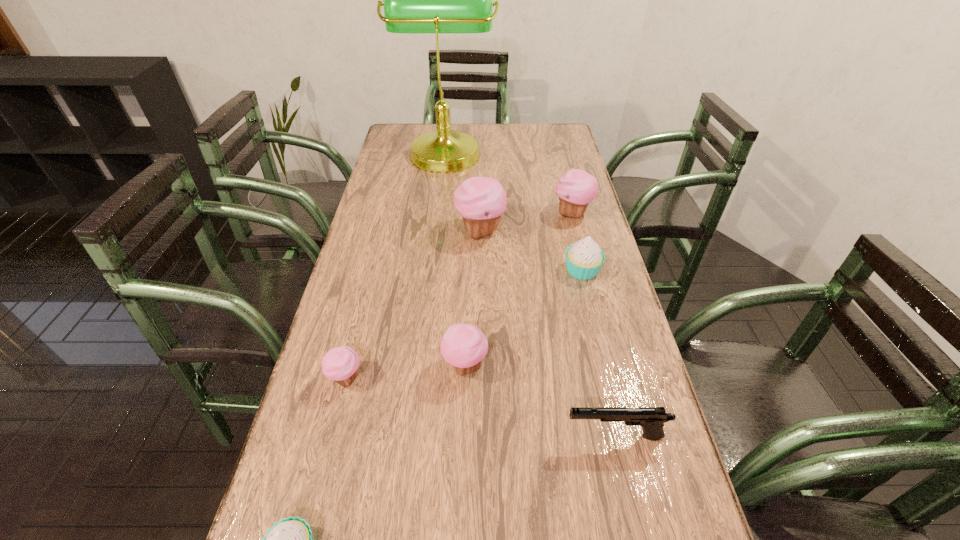
Where is `the farthest object`? the farthest object is located at coordinates tap(436, 0).

The image size is (960, 540). Identify the location of green lamp. (436, 0).

At what (x,y) coordinates should I click in order to perform the action: click on the biggest pink cupcake. Please return your answer as a coordinate pair (x, y). The image size is (960, 540). Looking at the image, I should click on (481, 201).

At what (x,y) coordinates should I click in order to perform the action: click on the tallest cupcake. Please return your answer as a coordinate pair (x, y). The width and height of the screenshot is (960, 540). Looking at the image, I should click on (481, 201).

The width and height of the screenshot is (960, 540). Find the location of `the third tallest object`. the third tallest object is located at coordinates (575, 189).

You are a GUI agent. You are given a task and a screenshot of the screen. Output one action in this format:
    pyautogui.click(x=<x>, y=<y>)
    Task: Click on the third smallest pink cupcake
    This screenshot has width=960, height=540.
    Given the screenshot: What is the action you would take?
    pyautogui.click(x=575, y=189)

Where is `the fifth nearest object`? The width and height of the screenshot is (960, 540). the fifth nearest object is located at coordinates (584, 259).

Locate an element on the screen. This screenshot has height=540, width=960. the right white cupcake is located at coordinates (584, 259).

At what (x,y) coordinates should I click in order to perform the action: click on the second smallest pink cupcake. Please return your answer as a coordinate pair (x, y). Image resolution: width=960 pixels, height=540 pixels. Looking at the image, I should click on (464, 346).

The image size is (960, 540). Identify the location of the second nearest object. (652, 419).